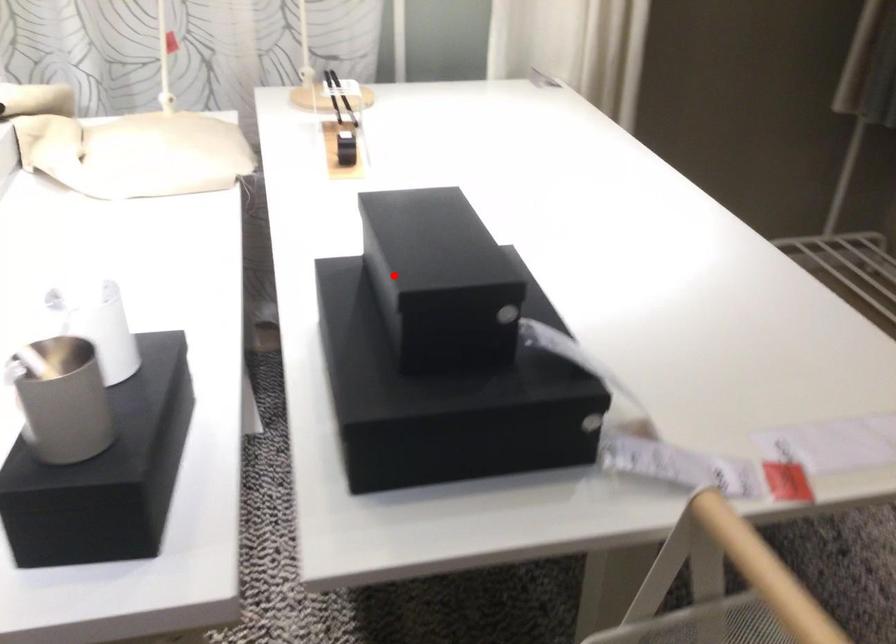
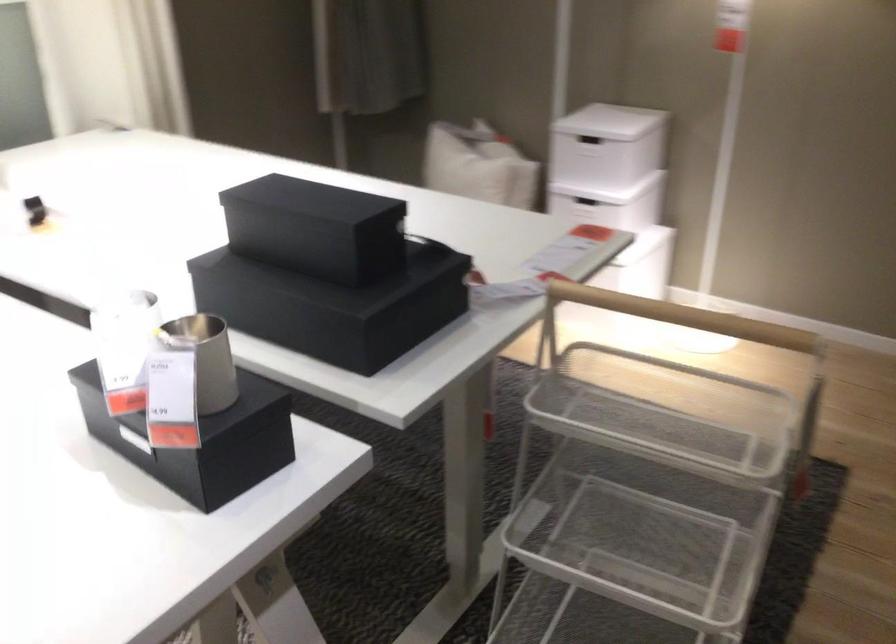
Question: I am providing you with two images of the same scene from different viewpoints. In image1, a red point is highlighted. Considering the same 3D point in image2, which of the following is correct?

Choices:
 (A) It is closer
 (B) It is farther

Answer: (B)